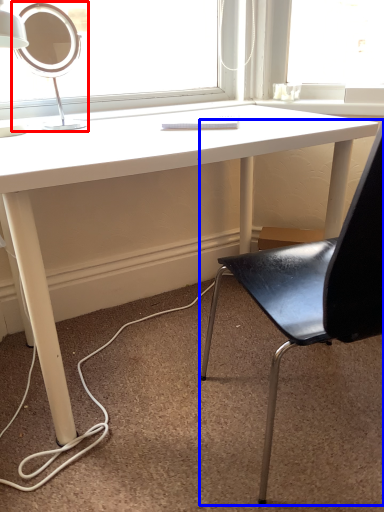
Question: Which object is closer to the camera taking this photo, table lamp (highlighted by a red box) or chair (highlighted by a blue box)?

Choices:
 (A) table lamp
 (B) chair

Answer: (B)